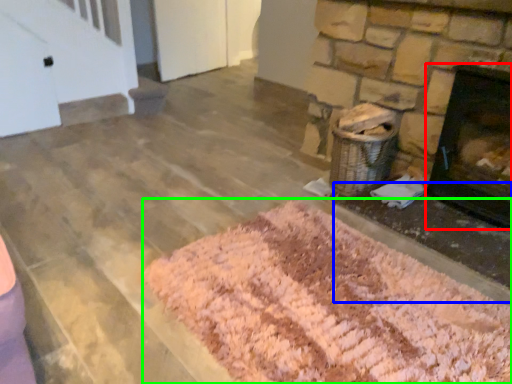
Question: Estimate the real-world distances between objects in this image. Which object is closer to fireplace (highlighted by a red box), foundation (highlighted by a blue box) or mat (highlighted by a green box)?

Choices:
 (A) foundation
 (B) mat

Answer: (A)